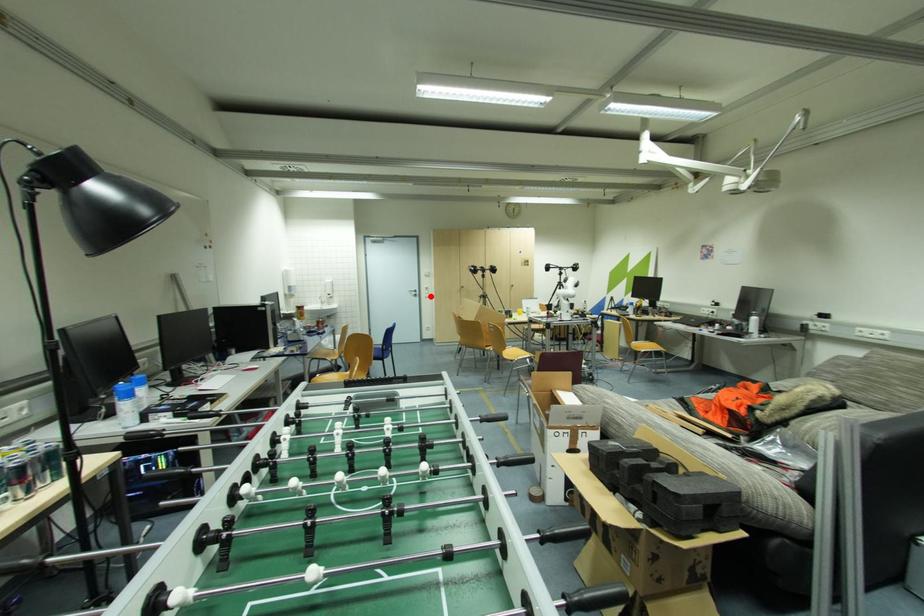
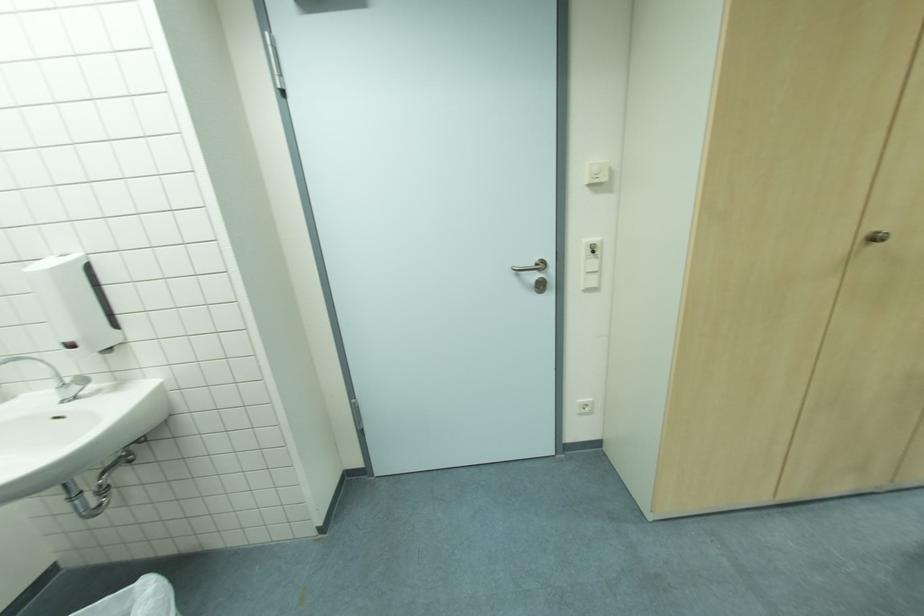
In the second image, find the point that corresponds to the highlighted location in the first image.

(598, 285)